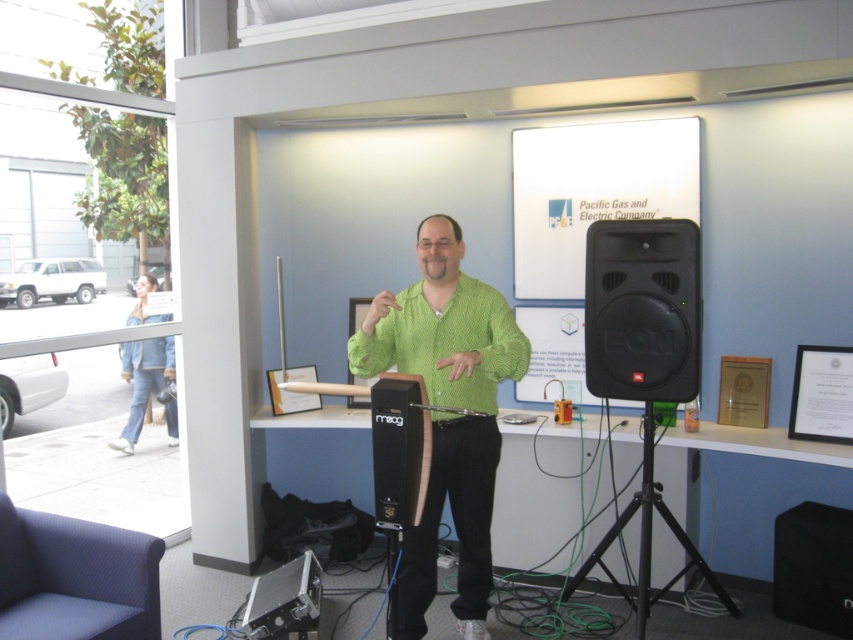
Is black plastic speaker at right further to camera compared to black matte tripod at lower right?

That is False.

The image size is (853, 640). Describe the element at coordinates (642, 308) in the screenshot. I see `black plastic speaker at right` at that location.

The width and height of the screenshot is (853, 640). Identify the location of black plastic speaker at right. (642, 308).

Is point (596, 369) positioned before point (399, 412)?

No, it is not.

Is black plastic speaker at right wider than black matte speaker at center?

Yes.

Who is more forward, (607, 392) or (381, 449)?

Positioned in front is point (381, 449).

What are the coordinates of `black plastic speaker at right` in the screenshot? It's located at (642, 308).

Can you confirm if black matte speaker at center is thinner than black matte tripod at lower right?

Indeed, black matte speaker at center has a lesser width compared to black matte tripod at lower right.

Does black matte speaker at center appear over black matte tripod at lower right?

Yes.

Locate an element on the screen. The height and width of the screenshot is (640, 853). black matte speaker at center is located at coordinates (399, 449).